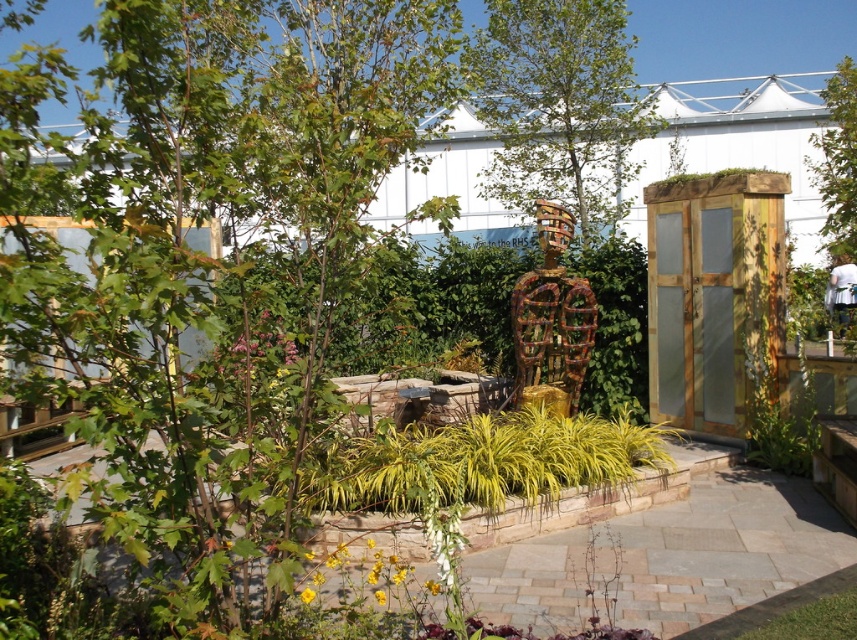
Question: Can you confirm if green leafy tree at upper center is positioned below green leafy tree at upper right?

Choices:
 (A) yes
 (B) no

Answer: (B)

Question: Does green leafy tree at upper center appear on the right side of green leafy tree at upper right?

Choices:
 (A) yes
 (B) no

Answer: (B)

Question: Which of the following is the closest to the observer?

Choices:
 (A) green leafy tree at upper right
 (B) green leafy tree at upper center

Answer: (A)

Question: In this image, where is green leafy tree at upper center located relative to green leafy tree at upper right?

Choices:
 (A) left
 (B) right

Answer: (A)

Question: Which point is farther to the camera?

Choices:
 (A) (487, 92)
 (B) (826, 227)

Answer: (A)